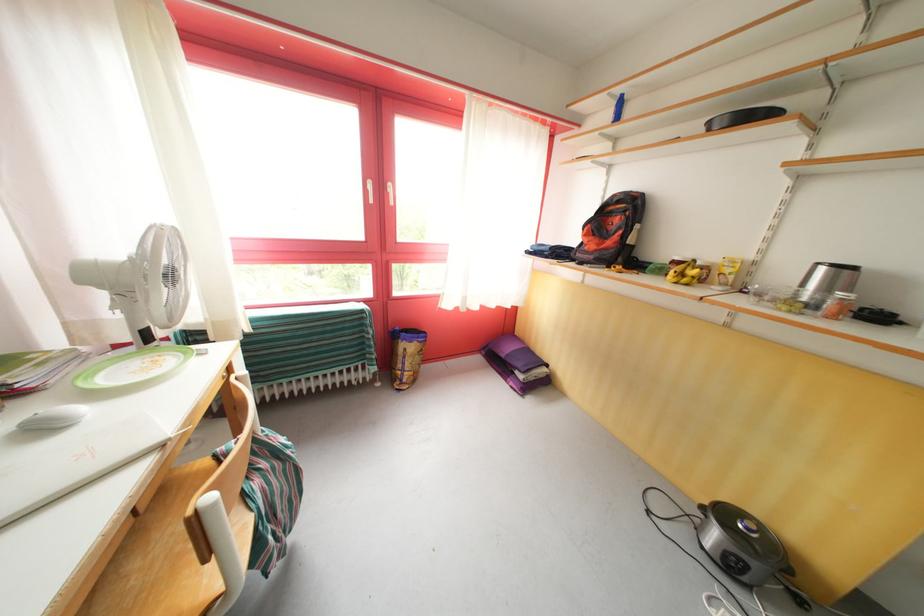
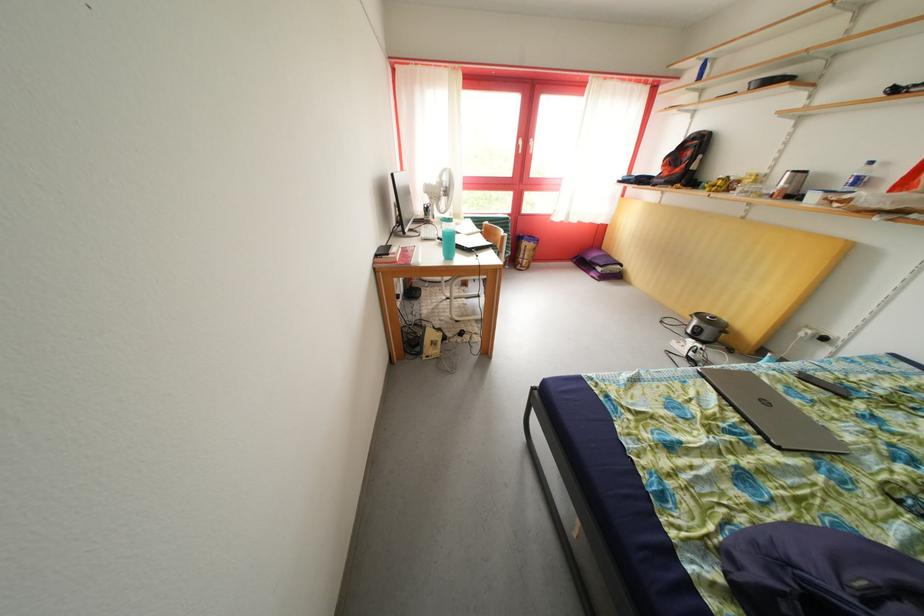
Question: Which direction would the cameraman need to move to produce the second image? Reply with the corresponding letter.

Choices:
 (A) Left
 (B) Right
 (C) Forward
 (D) Backward

Answer: (D)